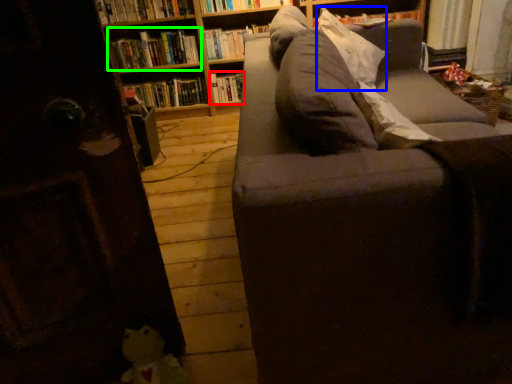
Question: Which object is positioned farthest from book (highlighted by a red box)? Select from pillow (highlighted by a blue box) and book (highlighted by a green box).

Choices:
 (A) pillow
 (B) book

Answer: (A)